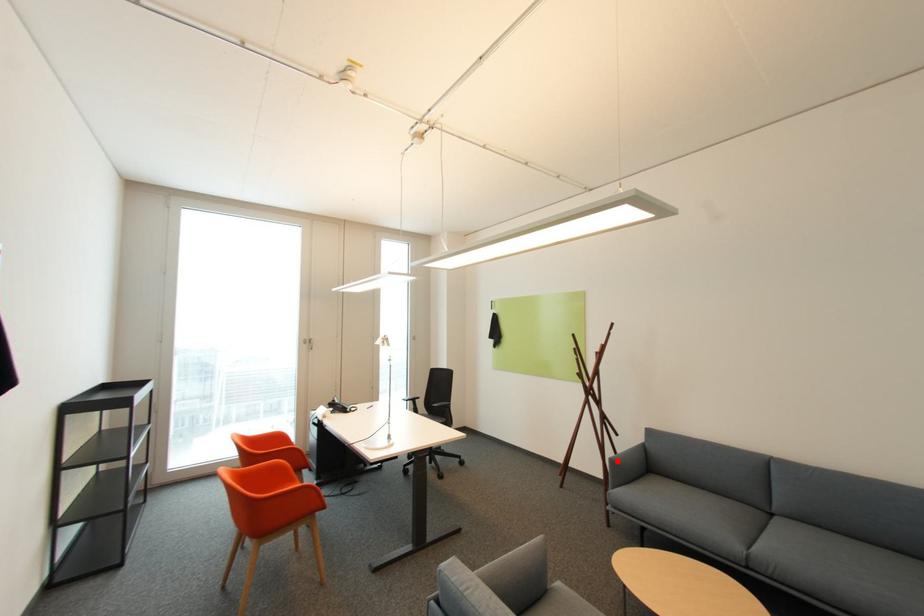
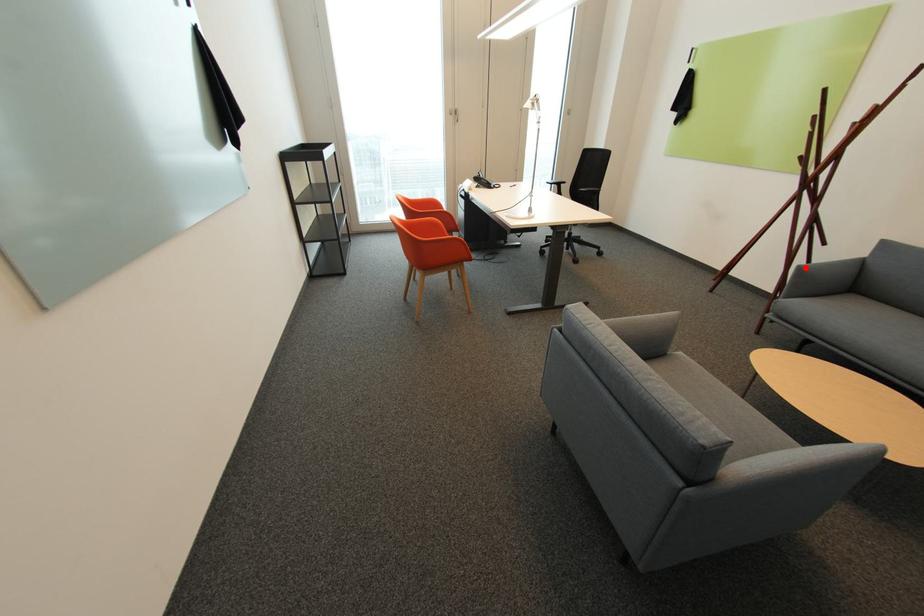
I am providing you with two images of the same scene from different viewpoints. A red point is marked on the first image and another point is marked on the second image. Are the points marked in image1 and image2 representing the same 3D position?

Yes